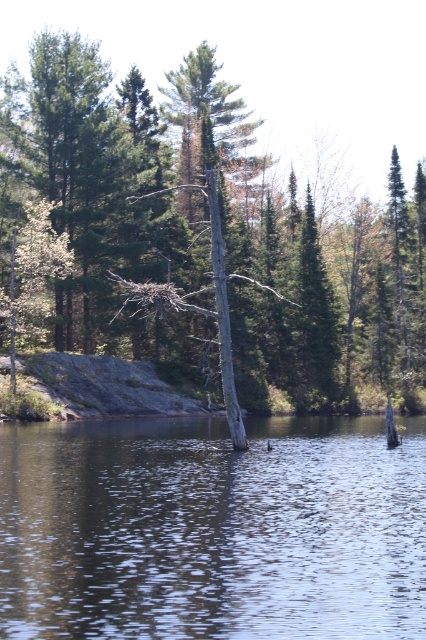
This screenshot has height=640, width=426. Find the location of `smooth gray tree trunk at center`. smooth gray tree trunk at center is located at coordinates (209, 237).